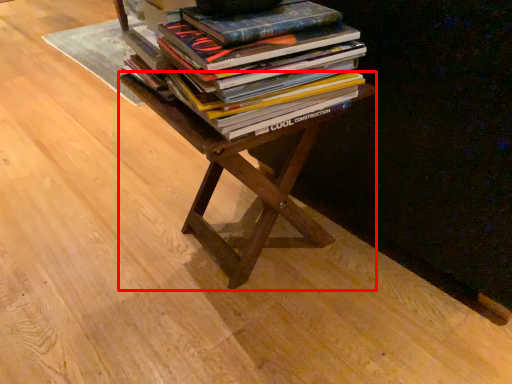
Question: From the image's perspective, what is the correct spatial relationship of table (annotated by the red box) in relation to book?

Choices:
 (A) below
 (B) above

Answer: (A)